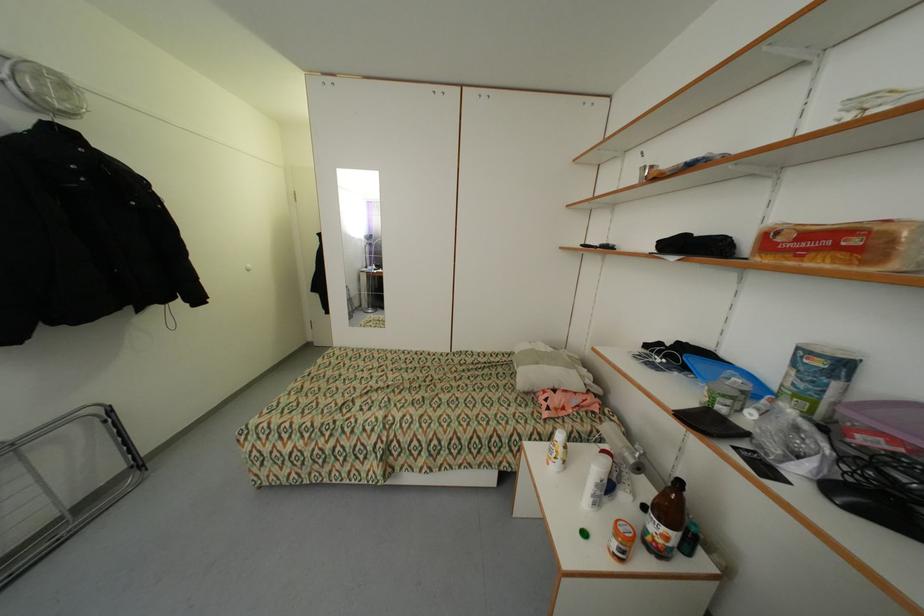
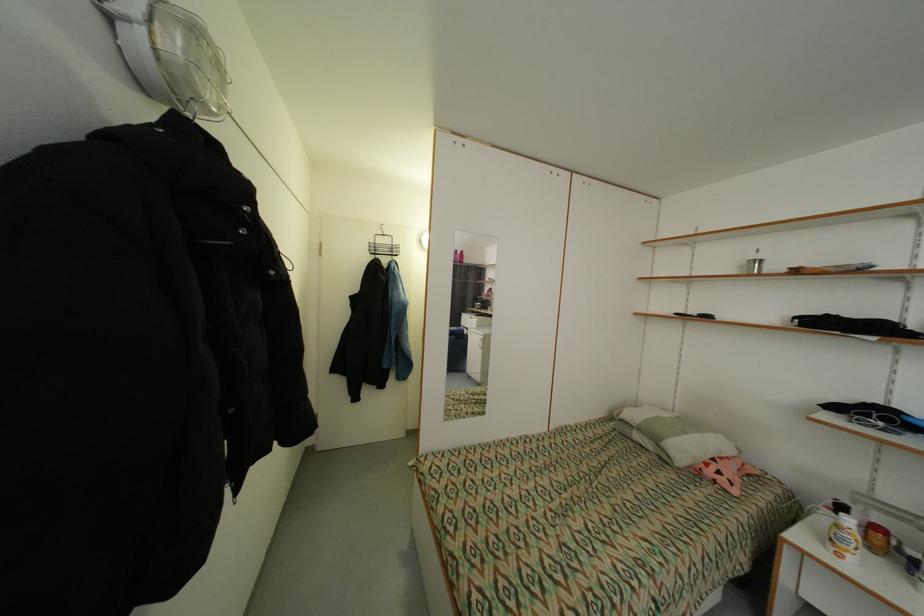
Question: The images are taken continuously from a first-person perspective. In which direction are you moving?

Choices:
 (A) Left
 (B) Right
 (C) Forward
 (D) Backward

Answer: (A)